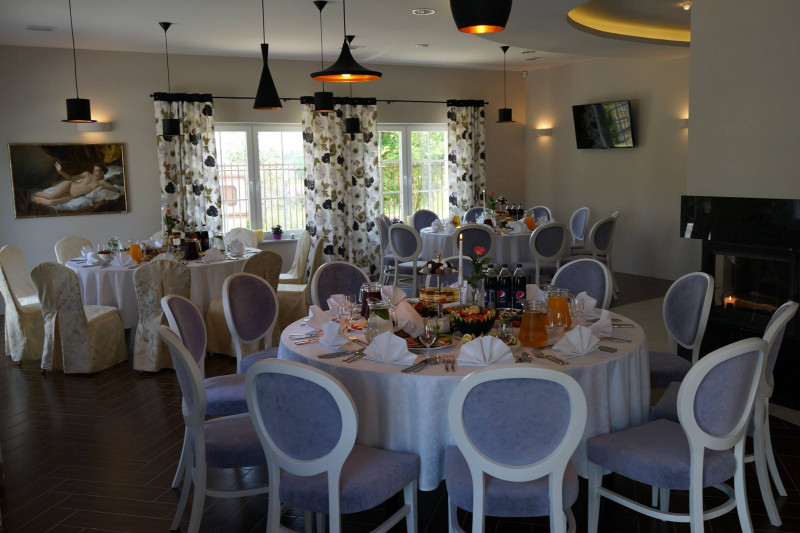
You are a GUI agent. You are given a task and a screenshot of the screen. Output one action in this format:
    pyautogui.click(x=<x>, y=<y>)
    Task: Click on the pendant light
    
    Given the screenshot: What is the action you would take?
    pyautogui.click(x=505, y=120), pyautogui.click(x=484, y=18), pyautogui.click(x=626, y=25), pyautogui.click(x=350, y=66), pyautogui.click(x=328, y=100), pyautogui.click(x=270, y=101), pyautogui.click(x=174, y=127), pyautogui.click(x=68, y=107), pyautogui.click(x=350, y=129)